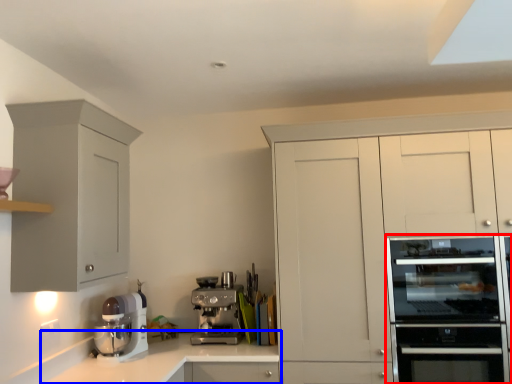
Question: Which of the following is the closest to the observer, home appliance (highlighted by a red box) or countertop (highlighted by a blue box)?

Choices:
 (A) home appliance
 (B) countertop

Answer: (A)